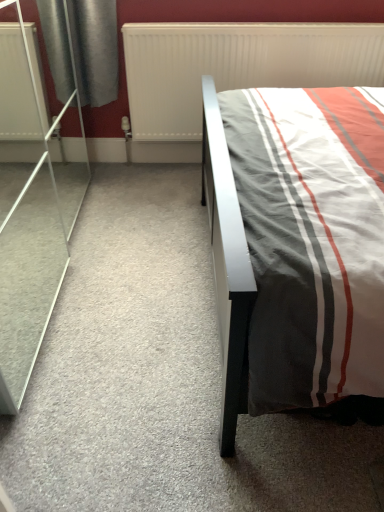
You are a GUI agent. You are given a task and a screenshot of the screen. Output one action in this format:
    pyautogui.click(x=<x>, y=<y>)
    Task: Click on the free space above white textured radiator at upper center (from a real-world perspective)
    
    Given the screenshot: What is the action you would take?
    pyautogui.click(x=207, y=17)